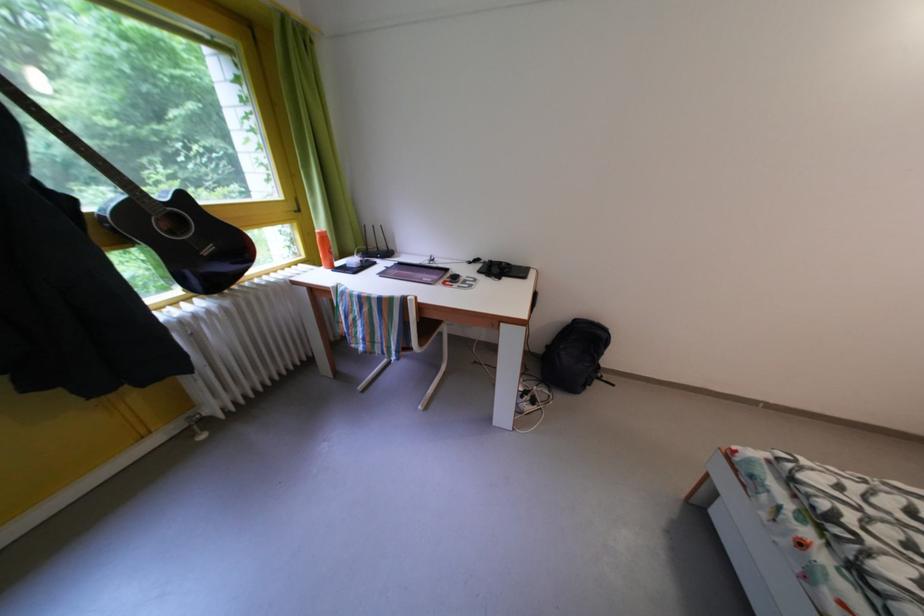
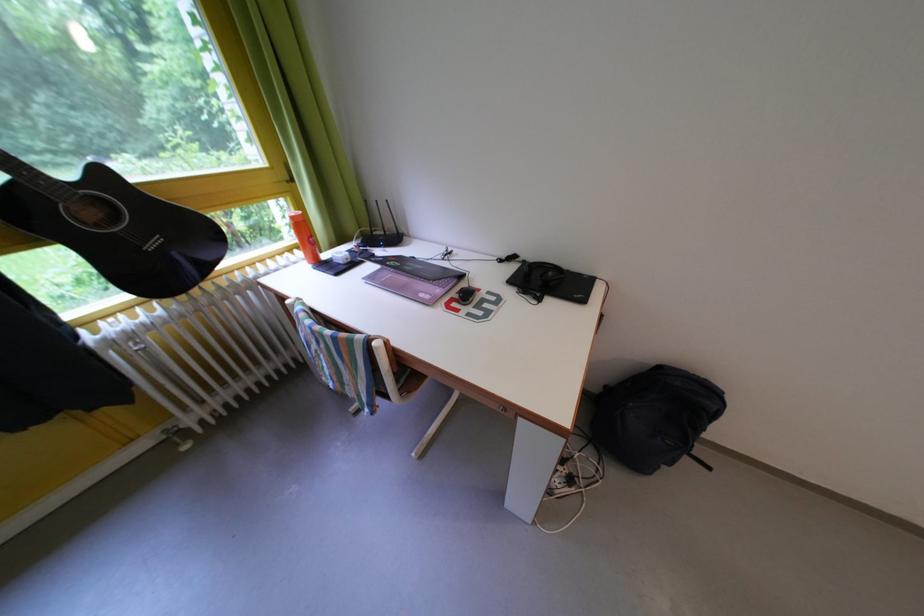
Question: In a continuous first-person perspective shot, in which direction is the camera moving?

Choices:
 (A) Left
 (B) Right
 (C) Forward
 (D) Backward

Answer: (C)